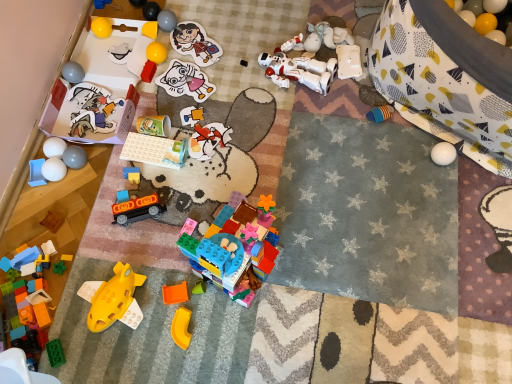
Where is `free space that is in between yellow rubber ball at upper left, positioned as the 11th toy in right-to-left order, and translucent orange plastic toy at center, placed as the 22th toy when sorted from left to right`? The height and width of the screenshot is (384, 512). free space that is in between yellow rubber ball at upper left, positioned as the 11th toy in right-to-left order, and translucent orange plastic toy at center, placed as the 22th toy when sorted from left to right is located at coordinates (173, 149).